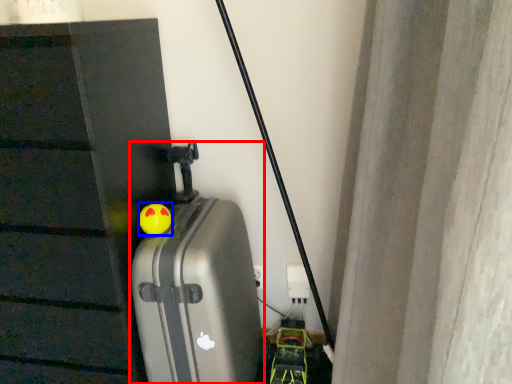
Question: Which point is further to the camera, suitcase (highlighted by a red box) or toy (highlighted by a blue box)?

Choices:
 (A) suitcase
 (B) toy

Answer: (B)